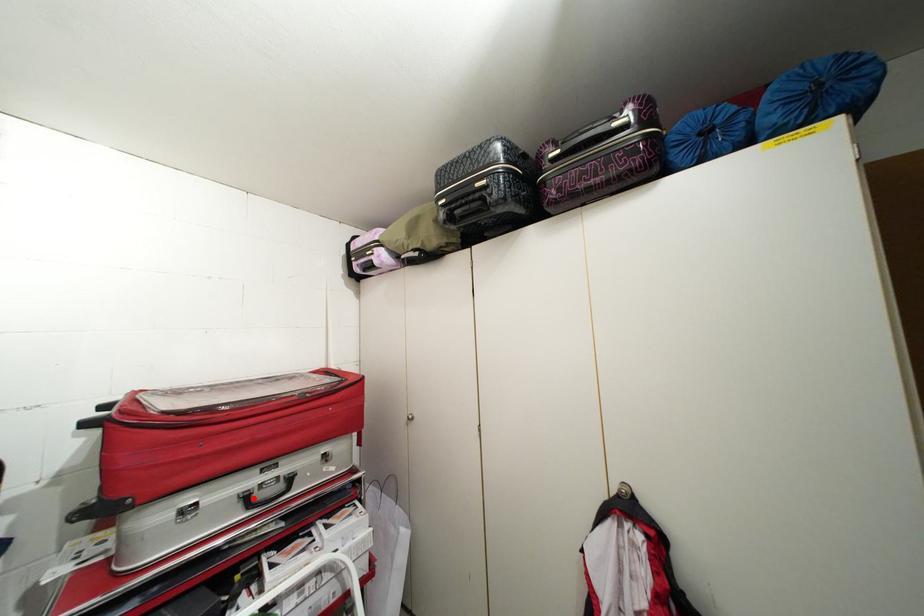
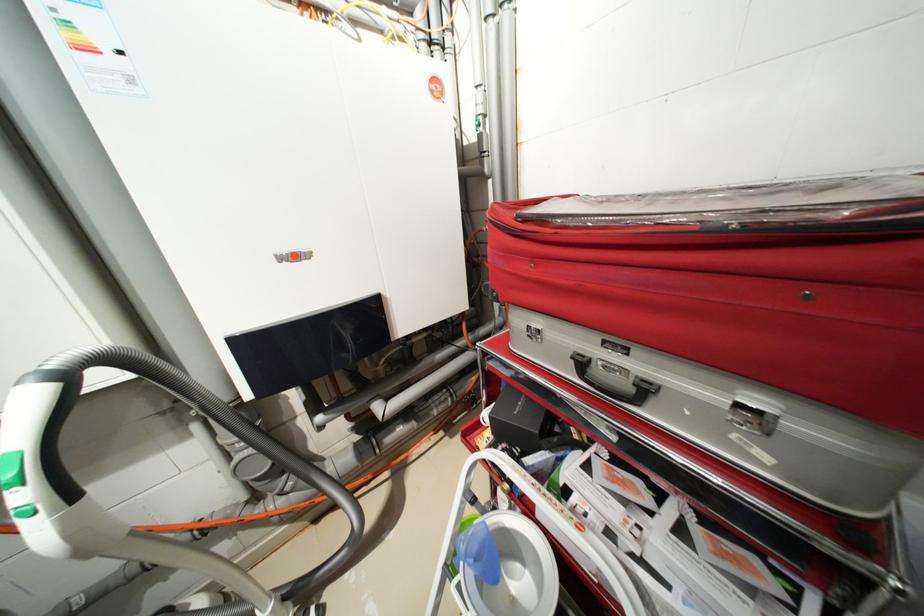
Find the pixel in the second image that matches the highlighted location in the first image.

(589, 363)